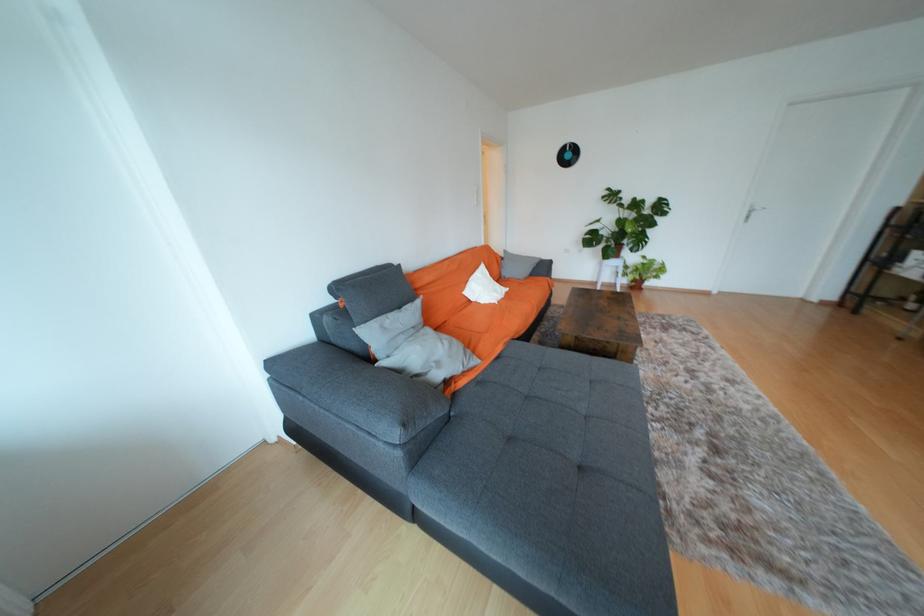
Can you provide the coordinates for the right terracotta planter in this image? Please return your answer as a coordinate pair (x, y).

(638, 284)